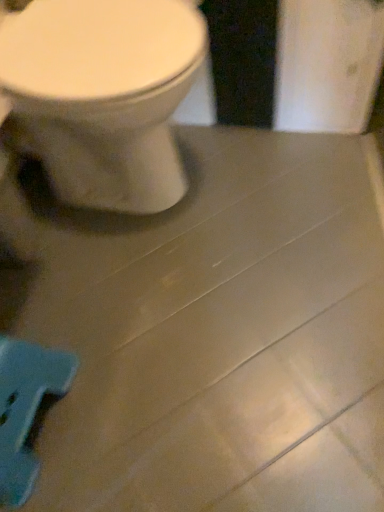
Describe the element at coordinates (25, 409) in the screenshot. I see `blue plastic toy at lower left` at that location.

Find the location of `blue plastic toy at lower left`. blue plastic toy at lower left is located at coordinates (25, 409).

Measure the distance between point (66, 357) and camera.

1.02 meters.

What is the approximate height of white glossy toilet at upper left?

The height of white glossy toilet at upper left is 26.61 inches.

Describe the element at coordinates (103, 96) in the screenshot. I see `white glossy toilet at upper left` at that location.

Where is `white glossy toilet at upper left`? Image resolution: width=384 pixels, height=512 pixels. white glossy toilet at upper left is located at coordinates (103, 96).

The image size is (384, 512). I want to click on blue plastic toy at lower left, so click(x=25, y=409).

Can you confirm if blue plastic toy at lower left is positioned to the left of white glossy toilet at upper left?

Indeed, blue plastic toy at lower left is positioned on the left side of white glossy toilet at upper left.

Does blue plastic toy at lower left lie in front of white glossy toilet at upper left?

No, blue plastic toy at lower left is behind white glossy toilet at upper left.

Is point (29, 458) positioned in front of point (186, 189)?

Yes.

Consider the image. From the image's perspective, is blue plastic toy at lower left below white glossy toilet at upper left?

Indeed, from the image's perspective, blue plastic toy at lower left is shown beneath white glossy toilet at upper left.

From a real-world perspective, which is physically below, blue plastic toy at lower left or white glossy toilet at upper left?

blue plastic toy at lower left, from a real-world perspective.

In terms of width, does blue plastic toy at lower left look wider or thinner when compared to white glossy toilet at upper left?

Clearly, blue plastic toy at lower left has less width compared to white glossy toilet at upper left.

Considering the sizes of objects blue plastic toy at lower left and white glossy toilet at upper left in the image provided, who is taller, blue plastic toy at lower left or white glossy toilet at upper left?

Standing taller between the two is white glossy toilet at upper left.

Looking at the image, does blue plastic toy at lower left seem bigger or smaller compared to white glossy toilet at upper left?

Considering their sizes, blue plastic toy at lower left takes up less space than white glossy toilet at upper left.

Choose the correct answer: Is blue plastic toy at lower left inside white glossy toilet at upper left or outside it?

blue plastic toy at lower left lies outside white glossy toilet at upper left.

Is blue plastic toy at lower left next to white glossy toilet at upper left and touching it?

blue plastic toy at lower left is not next to white glossy toilet at upper left, and they're not touching.

Is blue plastic toy at lower left looking in the opposite direction of white glossy toilet at upper left?

No, white glossy toilet at upper left is not at the back of blue plastic toy at lower left.

Find the location of `toilet above the blue plastic toy at lower left (from a real-world perspective)`. toilet above the blue plastic toy at lower left (from a real-world perspective) is located at coordinates [x=103, y=96].

Between white glossy toilet at upper left and blue plastic toy at lower left, which one appears on the right side from the viewer's perspective?

Positioned to the right is white glossy toilet at upper left.

Is white glossy toilet at upper left positioned before blue plastic toy at lower left?

Yes, the depth of white glossy toilet at upper left is less than that of blue plastic toy at lower left.

Considering the points (153, 103) and (7, 454), which point is behind, point (153, 103) or point (7, 454)?

The point (153, 103) is farther from the camera.

From the image's perspective, is white glossy toilet at upper left above or below blue plastic toy at lower left?

From the image's perspective, white glossy toilet at upper left appears above blue plastic toy at lower left.

From a real-world perspective, which object rests below the other?

blue plastic toy at lower left.

Between white glossy toilet at upper left and blue plastic toy at lower left, which one has smaller width?

blue plastic toy at lower left is thinner.

Is white glossy toilet at upper left taller than blue plastic toy at lower left?

Yes.

Considering the sizes of objects white glossy toilet at upper left and blue plastic toy at lower left in the image provided, who is smaller, white glossy toilet at upper left or blue plastic toy at lower left?

With smaller size is blue plastic toy at lower left.

Would you say white glossy toilet at upper left is inside or outside blue plastic toy at lower left?

white glossy toilet at upper left is located beyond the bounds of blue plastic toy at lower left.

Does white glossy toilet at upper left touch blue plastic toy at lower left?

No, white glossy toilet at upper left is not touching blue plastic toy at lower left.

Is white glossy toilet at upper left turned away from blue plastic toy at lower left?

white glossy toilet at upper left is not turned away from blue plastic toy at lower left.

At what (x,y) coordinates should I click in order to perform the action: click on porcelain below the white glossy toilet at upper left (from the image's perspective). Please return your answer as a coordinate pair (x, y). The width and height of the screenshot is (384, 512). Looking at the image, I should click on (25, 409).

Locate an element on the screen. This screenshot has height=512, width=384. porcelain below the white glossy toilet at upper left (from the image's perspective) is located at coordinates (25, 409).

The height and width of the screenshot is (512, 384). Identify the location of toilet that is above the blue plastic toy at lower left (from the image's perspective). (103, 96).